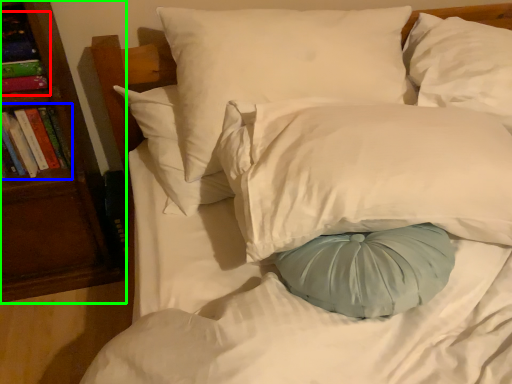
Question: Considering the real-world distances, which object is closest to book (highlighted by a red box)? book (highlighted by a blue box) or bookshelf (highlighted by a green box).

Choices:
 (A) book
 (B) bookshelf

Answer: (A)